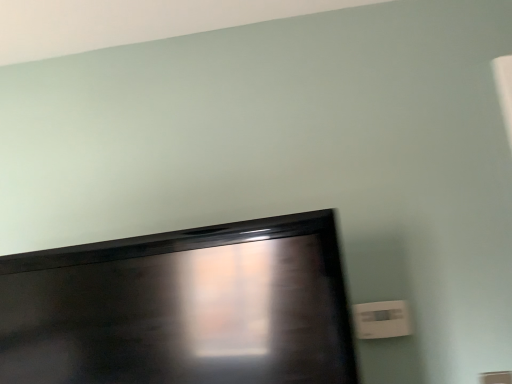
Question: Relative to white plastic electric outlet at lower right, is matte black tv at lower left in front or behind?

Choices:
 (A) behind
 (B) front

Answer: (B)

Question: Considering the positions of matte black tv at lower left and white plastic electric outlet at lower right in the image, is matte black tv at lower left wider or thinner than white plastic electric outlet at lower right?

Choices:
 (A) thin
 (B) wide

Answer: (B)

Question: Is point (282, 248) positioned closer to the camera than point (396, 302)?

Choices:
 (A) farther
 (B) closer

Answer: (B)

Question: Is point (375, 329) positioned closer to the camera than point (12, 380)?

Choices:
 (A) closer
 (B) farther

Answer: (B)

Question: Based on their positions, is white plastic electric outlet at lower right located to the left or right of matte black tv at lower left?

Choices:
 (A) left
 (B) right

Answer: (B)

Question: From the image's perspective, is white plastic electric outlet at lower right located above or below matte black tv at lower left?

Choices:
 (A) above
 (B) below

Answer: (B)

Question: From a real-world perspective, is white plastic electric outlet at lower right physically located above or below matte black tv at lower left?

Choices:
 (A) below
 (B) above

Answer: (A)